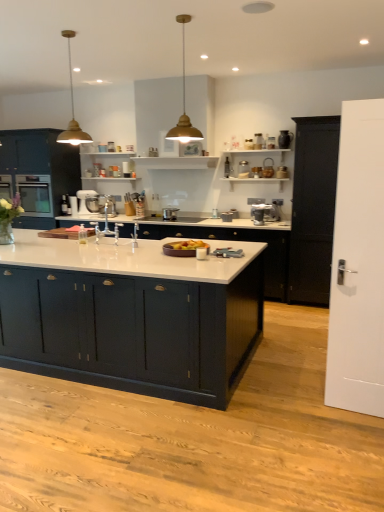
Question: From the image's perspective, is silver metallic pot at center, positioned as the fourth appliance in right-to-left order, positioned above or below white glossy countertop at center, which ranks as the 2th cabinetry in back-to-front order?

Choices:
 (A) below
 (B) above

Answer: (B)

Question: Considering the positions of silver metallic pot at center, marked as the third appliance in a left-to-right arrangement, and white glossy countertop at center, which ranks as the 2th cabinetry in back-to-front order, in the image, is silver metallic pot at center, marked as the third appliance in a left-to-right arrangement, taller or shorter than white glossy countertop at center, which ranks as the 2th cabinetry in back-to-front order,?

Choices:
 (A) short
 (B) tall

Answer: (A)

Question: Estimate the real-world distances between objects in this image. Which object is farther from the metallic silver stand mixer at center, the 6th appliance from the right?

Choices:
 (A) brushed metal sink at center, the second appliance in the left-to-right sequence
 (B) white matte door at right
 (C) satin black oven at left
 (D) matte dark blue cabinets at left, which is the first cabinetry in back-to-front order
 (E) matte glass jar at upper center, positioned as the 4th appliance in left-to-right order

Answer: (B)

Question: Based on their relative distances, which object is farther from the matte dark blue cabinets at left, which is the first cabinetry in back-to-front order?

Choices:
 (A) gold metal pendant light at upper center, acting as the second light fixture starting from the right
 (B) matte dark blue cabinet at center, acting as the fourth cabinetry starting from the back
 (C) satin silver coffee maker at center, positioned as the 2th appliance in right-to-left order
 (D) black wood door at right, acting as the second cabinetry starting from the front
 (E) white glossy countertop at center, which appears as the 3th cabinetry when viewed from the front

Answer: (D)